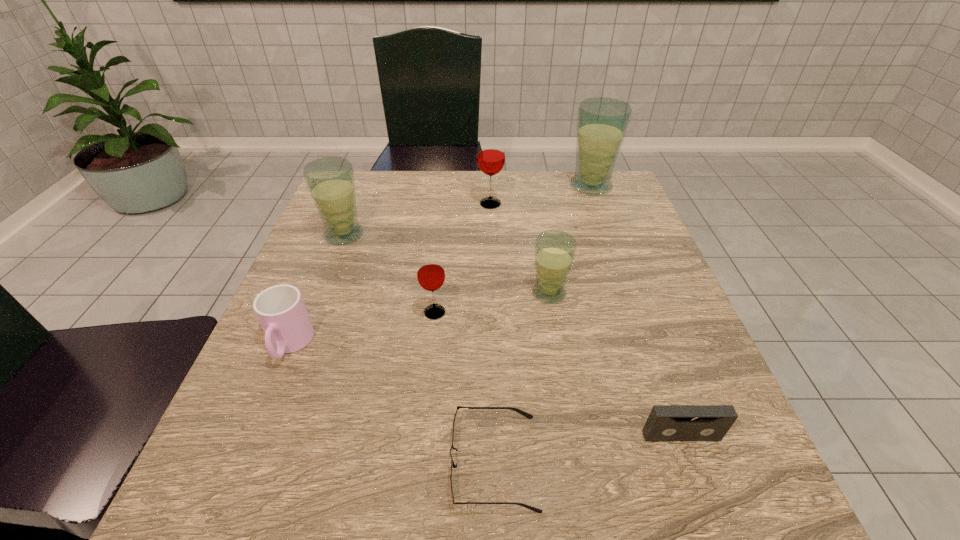
Where is `vacant point that satisfies the following two spatial constraints: 1. on the front side of the second glass from right to left; 2. on the front-facing side of the spectacles`? This screenshot has height=540, width=960. vacant point that satisfies the following two spatial constraints: 1. on the front side of the second glass from right to left; 2. on the front-facing side of the spectacles is located at coordinates (577, 462).